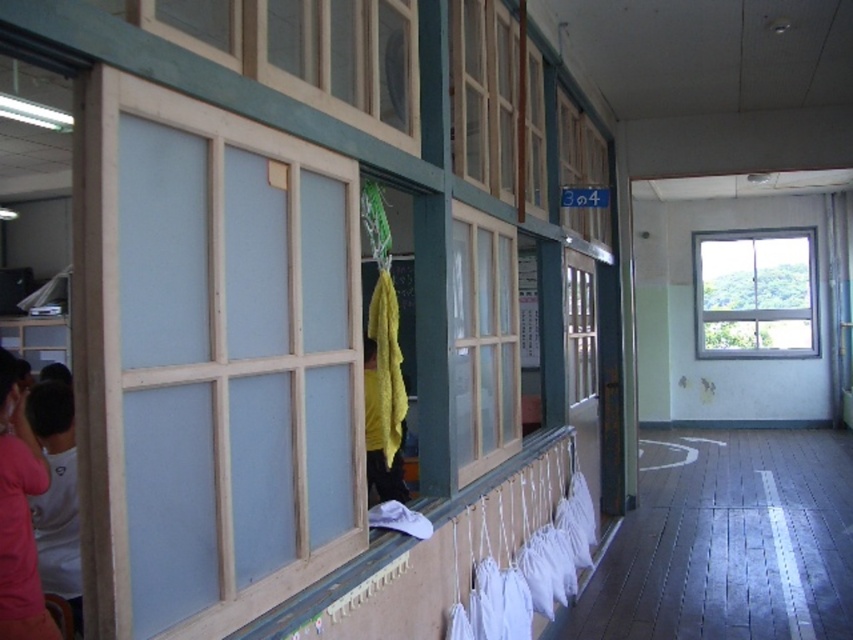
Who is more forward, (9, 400) or (44, 516)?

Point (9, 400) is in front.

Does pink fabric at lower left have a greater height compared to white cotton shirt at lower left?

No.

Does point (16, 456) lie behind point (68, 449)?

No, it is in front of (68, 449).

Find the location of a particular element. pink fabric at lower left is located at coordinates pos(19,515).

Between clear glass window at upper right and clear glass window at center, which one appears on the left side from the viewer's perspective?

clear glass window at center

Is point (813, 316) positioned in front of point (573, 260)?

No, (813, 316) is behind (573, 260).

Identify the location of clear glass window at upper right. The image size is (853, 640). (755, 292).

This screenshot has height=640, width=853. I want to click on clear glass window at upper right, so click(x=755, y=292).